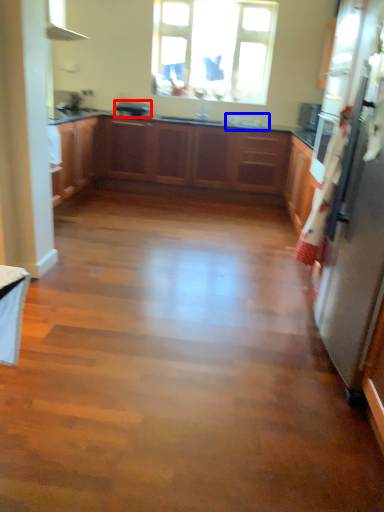
Question: Which point is closer to the camera, appliance (highlighted by a red box) or sink (highlighted by a blue box)?

Choices:
 (A) appliance
 (B) sink

Answer: (B)